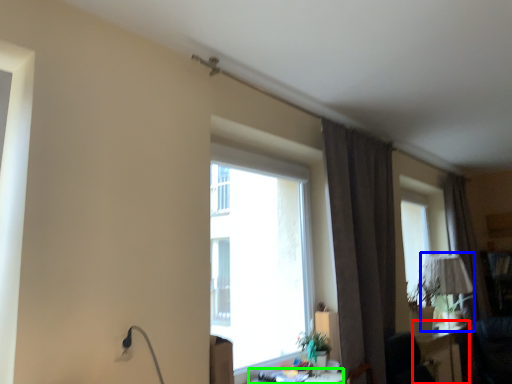
Question: Estimate the real-world distances between objects in this image. Which object is farther from table (highlighted by a red box), table lamp (highlighted by a blue box) or table (highlighted by a green box)?

Choices:
 (A) table lamp
 (B) table

Answer: (B)